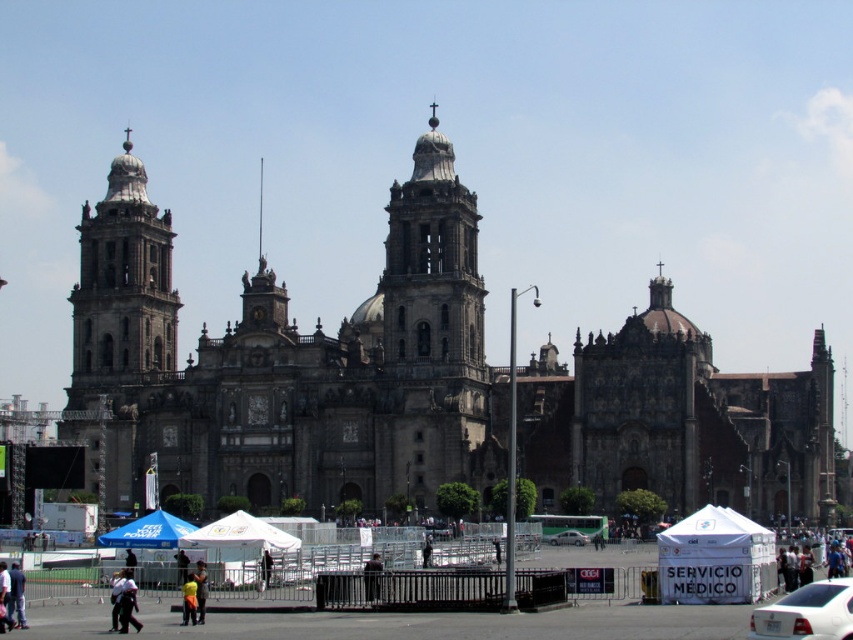
You are a photographer standing at the entrance of the cathedral. You want to capture a photo that includes both the white cotton shirt at lower left and the black fabric umbrella at center. Which object should you adjust your camera angle to include first if you need to ensure both are fully visible?

The white cotton shirt at lower left has a larger size compared to the black fabric umbrella at center. To ensure both are fully visible, you should adjust your camera angle to include the larger white cotton shirt at lower left first, then frame the smaller black fabric umbrella at center accordingly.

You are a visitor at the cathedral and see the black leather jacket at lower center and the black fabric umbrella at center. Which object is positioned higher from the ground?

The black leather jacket at lower center is located above the black fabric umbrella at center, so it is positioned higher from the ground.

You are a visitor standing in front of the cathedral and see the black leather jacket at lower center and the black fabric umbrella at center. Which object is taller?

The black fabric umbrella at center is taller than the black leather jacket at lower center.